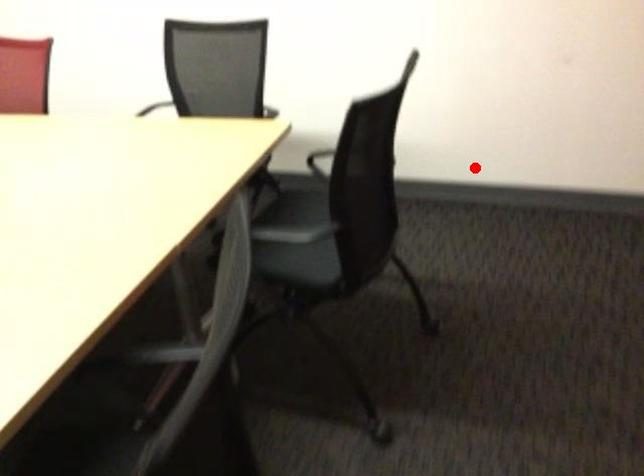
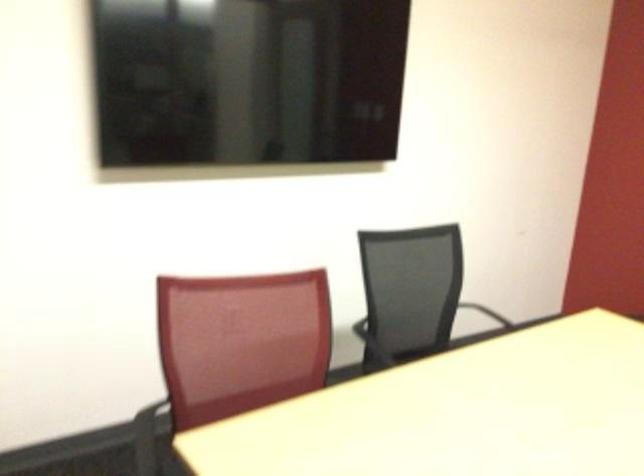
Locate, in the second image, the point that corresponds to the highlighted location in the first image.

(498, 318)